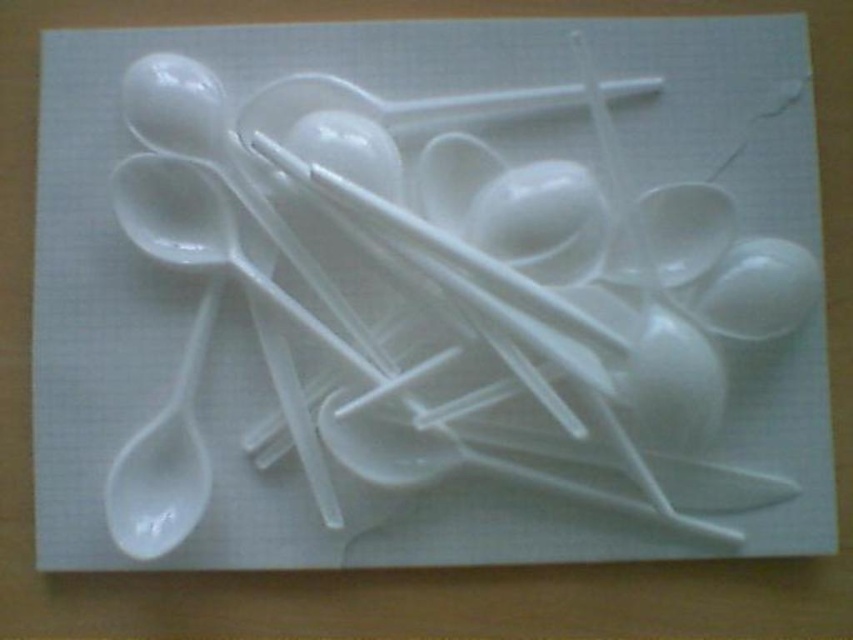
Who is lower down, white matte spoon at left or white glossy spoon at center?

white matte spoon at left is lower down.

Does white matte spoon at left have a lesser height compared to white glossy spoon at center?

No, white matte spoon at left is not shorter than white glossy spoon at center.

At what (x,y) coordinates should I click in order to perform the action: click on white matte spoon at left. Please return your answer as a coordinate pair (x, y). The width and height of the screenshot is (853, 640). Looking at the image, I should click on (165, 458).

Can you confirm if white plastic spoon at center is wider than white glossy spoon at center?

Yes.

Which is above, white plastic spoon at center or white glossy spoon at center?

Positioned higher is white glossy spoon at center.

Describe the element at coordinates (431, 301) in the screenshot. The height and width of the screenshot is (640, 853). I see `white plastic spoon at center` at that location.

At what (x,y) coordinates should I click in order to perform the action: click on white plastic spoon at center. Please return your answer as a coordinate pair (x, y). Image resolution: width=853 pixels, height=640 pixels. Looking at the image, I should click on (431, 301).

Is white plastic spoon at center shorter than white matte spoon at left?

No, white plastic spoon at center is not shorter than white matte spoon at left.

You are a GUI agent. You are given a task and a screenshot of the screen. Output one action in this format:
    pyautogui.click(x=<x>, y=<y>)
    Task: Click on the white plastic spoon at center
    
    Given the screenshot: What is the action you would take?
    pyautogui.click(x=431, y=301)

Between point (723, 216) and point (160, 524), which one is positioned behind?

The point (723, 216) is more distant.

Locate an element on the screen. white plastic spoon at center is located at coordinates (431, 301).